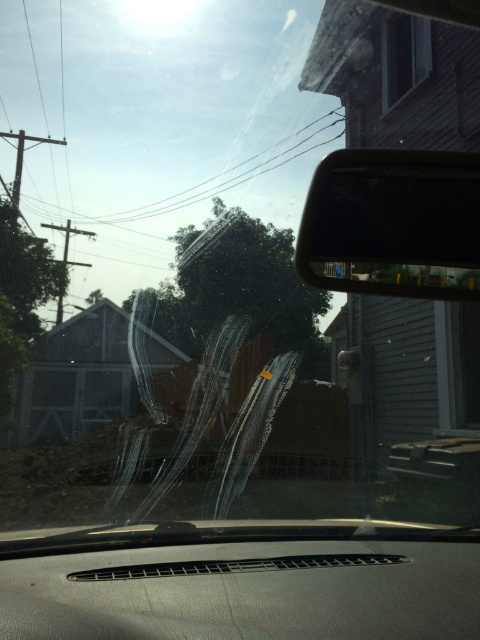
Which of these two, matte gray dashboard at center or black glossy view mirror at upper right, stands taller?

black glossy view mirror at upper right is taller.

Which is above, matte gray dashboard at center or black glossy view mirror at upper right?

black glossy view mirror at upper right

Does point (252, 611) come behind point (444, 292)?

No, (252, 611) is closer to viewer.

You are a GUI agent. You are given a task and a screenshot of the screen. Output one action in this format:
    pyautogui.click(x=<x>, y=<y>)
    Task: Click on the matte gray dashboard at center
    The height and width of the screenshot is (640, 480).
    Given the screenshot: What is the action you would take?
    pyautogui.click(x=247, y=592)